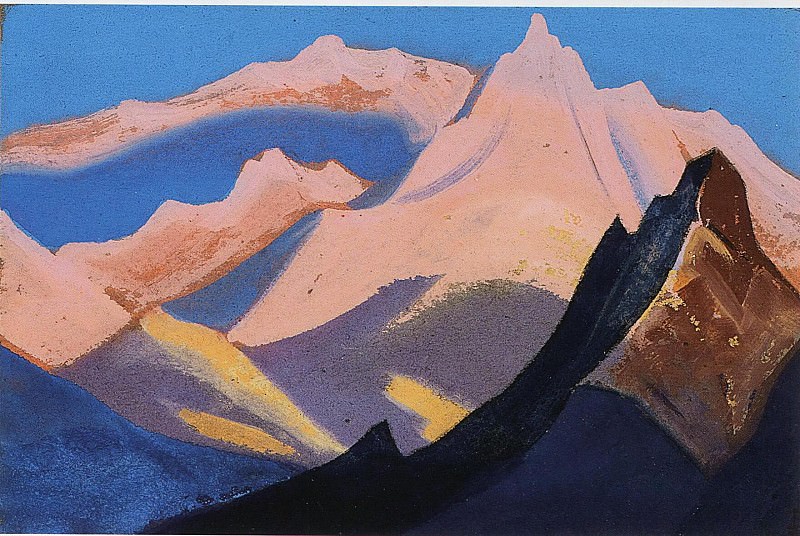
I want to click on peninsula, so click(173, 110).